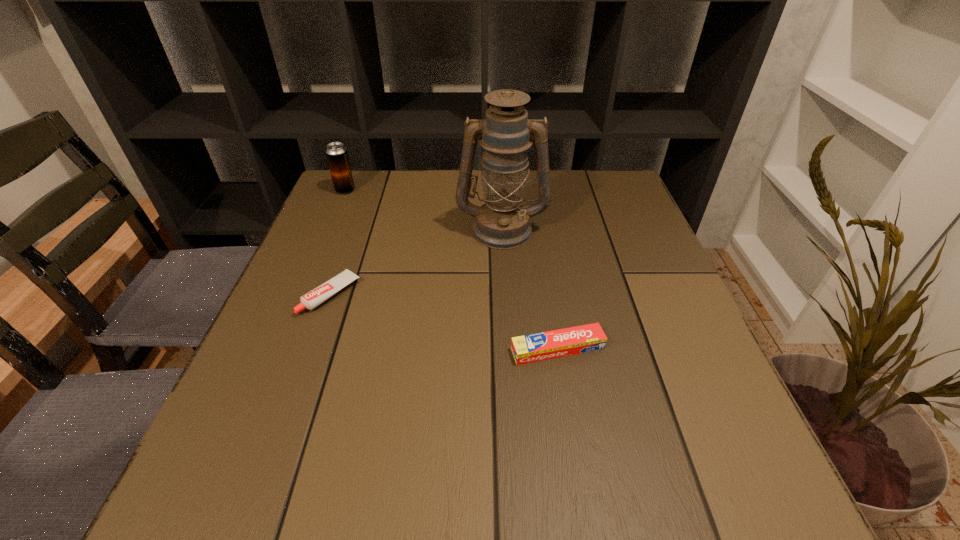
Where is `the tallest object`? This screenshot has height=540, width=960. the tallest object is located at coordinates (502, 222).

I want to click on the second farthest object, so click(x=502, y=222).

Where is `the farthest object`? The height and width of the screenshot is (540, 960). the farthest object is located at coordinates (337, 156).

Where is `beer can`? The height and width of the screenshot is (540, 960). beer can is located at coordinates (337, 156).

This screenshot has height=540, width=960. In order to click on the farther toothpaste in this screenshot , I will do `click(314, 298)`.

Where is `the third farthest object`? The width and height of the screenshot is (960, 540). the third farthest object is located at coordinates (314, 298).

What are the coordinates of `the nearer toothpaste` in the screenshot? It's located at (558, 343).

The height and width of the screenshot is (540, 960). What are the coordinates of `the nearest object` in the screenshot? It's located at (558, 343).

Image resolution: width=960 pixels, height=540 pixels. In order to click on vacant space located 0.290m on the left of the tallest object in this screenshot , I will do `click(339, 229)`.

This screenshot has width=960, height=540. In order to click on free space located on the front of the beer can in this screenshot , I will do `click(300, 293)`.